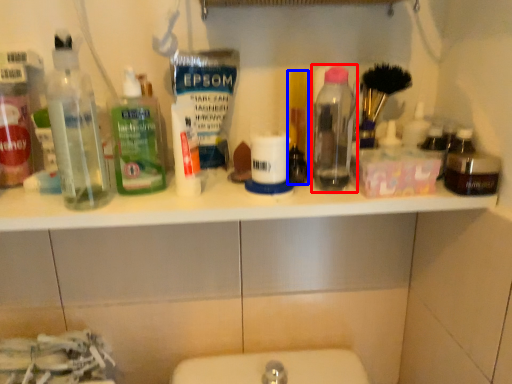
Question: Which object appears closest to the camera in this image, bottle (highlighted by a red box) or personal care (highlighted by a blue box)?

Choices:
 (A) bottle
 (B) personal care

Answer: (A)